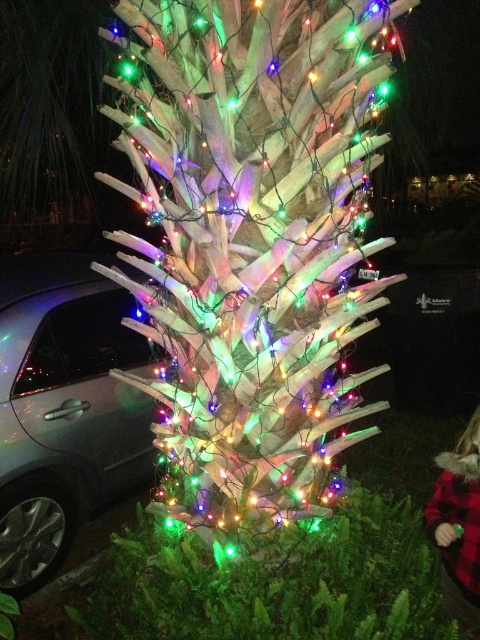
What is the 2D coordinate of the iridescent white lights at center in the image?

The iridescent white lights at center are located at the 2D coordinate point of (254, 241).

You are standing in front of the Christmas tree and want to place a decoration at one of the two points marked. The first point is at coordinates point (335, 8) and the second is at point (113, 387). Which point is closer to you?

Point (335, 8) is closer to the viewer than point (113, 387).